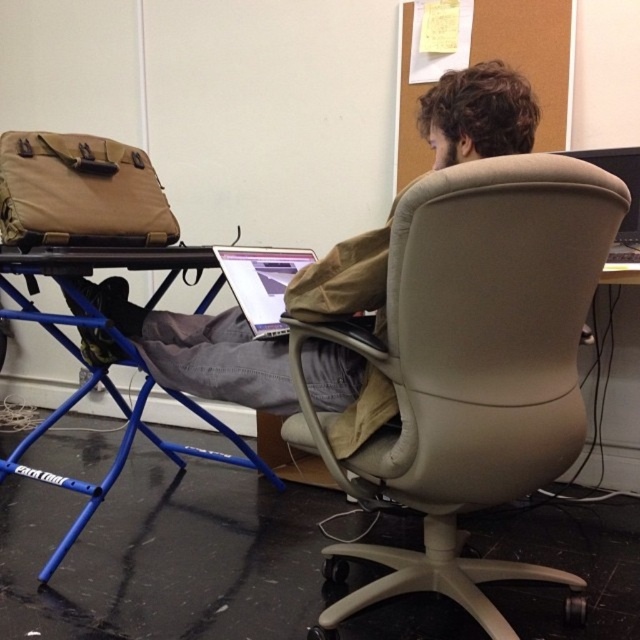
You are an office assistant and need to move the beige fabric office chair at center and the matte khaki jacket at center to a storage room. Which object requires more space to store?

The beige fabric office chair at center requires more space to store since it has a larger size compared to the matte khaki jacket at center.

You are an office cleaner who needs to reach the matte khaki jacket at center. The beige fabric office chair at center is in your way. Can you move the chair to the right to get to the jacket?

The beige fabric office chair at center is already to the right of the matte khaki jacket at center, so moving it further right would not help you reach the jacket. Instead, you should move the chair to the left to access the jacket.